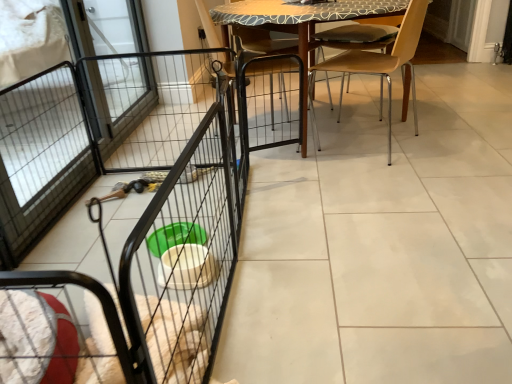
Image resolution: width=512 pixels, height=384 pixels. Identify the location of vacant region to the left of light brown wood chair at center. (293, 157).